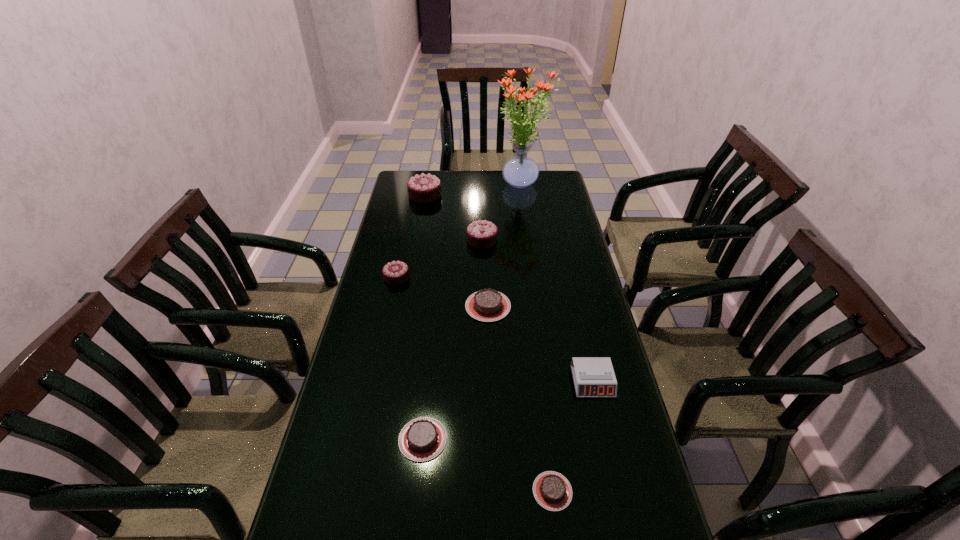
Locate an element on the screen. free space located on the back of the farthest brown chocolate cake is located at coordinates (487, 229).

Find the location of `vacant space located on the front of the leftmost brown chocolate cake`. vacant space located on the front of the leftmost brown chocolate cake is located at coordinates (417, 497).

At what (x,y) coordinates should I click in order to perform the action: click on vacant region located on the left of the rightmost chocolate cake. Please return your answer as a coordinate pair (x, y). The height and width of the screenshot is (540, 960). Looking at the image, I should click on (463, 491).

At what (x,y) coordinates should I click in order to perform the action: click on flower arrangement that is at the far edge. Please return your answer as a coordinate pair (x, y). The image size is (960, 540). Looking at the image, I should click on (520, 171).

Identify the location of chocolate cake that is at the far edge. (425, 188).

The image size is (960, 540). In order to click on flower arrangement at the right edge in this screenshot , I will do `click(520, 171)`.

Where is `alarm clock located in the right edge section of the desktop`? alarm clock located in the right edge section of the desktop is located at coordinates (593, 376).

Locate an element on the screen. Image resolution: width=960 pixels, height=540 pixels. object at the far left corner is located at coordinates (425, 188).

Identify the location of object that is at the far right corner. The width and height of the screenshot is (960, 540). (520, 171).

Identify the location of vacant area at the far edge of the desktop. (517, 191).